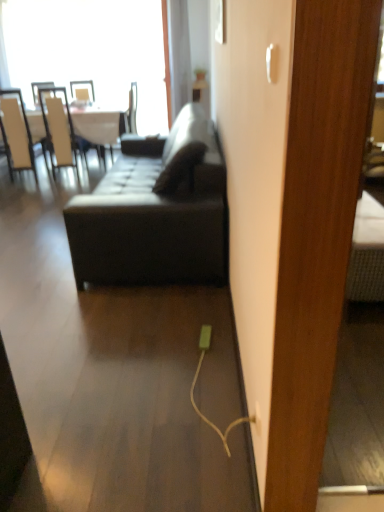
Question: Is white glossy table at upper left to the left of white leather chair at left, which ranks as the 2th chair in right-to-left order, from the viewer's perspective?

Choices:
 (A) yes
 (B) no

Answer: (B)

Question: Can you confirm if white glossy table at upper left is wider than white leather chair at left, which ranks as the 2th chair in right-to-left order?

Choices:
 (A) no
 (B) yes

Answer: (B)

Question: From a real-world perspective, is white glossy table at upper left on white leather chair at left, which ranks as the 2th chair in right-to-left order?

Choices:
 (A) no
 (B) yes

Answer: (A)

Question: From the image's perspective, is white glossy table at upper left under white leather chair at left, which appears as the 1th chair when viewed from the left?

Choices:
 (A) yes
 (B) no

Answer: (B)

Question: Is white leather chair at left, which ranks as the 2th chair in right-to-left order, located within white glossy table at upper left?

Choices:
 (A) yes
 (B) no

Answer: (A)

Question: Is white glossy table at upper left far from white leather chair at left, which appears as the 1th chair when viewed from the left?

Choices:
 (A) no
 (B) yes

Answer: (A)

Question: Would you consider white leather chair at left, the 2th chair in the left-to-right sequence, to be distant from matte black couch at center?

Choices:
 (A) no
 (B) yes

Answer: (B)

Question: Is white leather chair at left, the 2th chair in the left-to-right sequence, oriented towards matte black couch at center?

Choices:
 (A) yes
 (B) no

Answer: (B)

Question: Considering the relative positions of white leather chair at left, the 1th chair viewed from the right, and matte black couch at center in the image provided, is white leather chair at left, the 1th chair viewed from the right, to the right of matte black couch at center from the viewer's perspective?

Choices:
 (A) no
 (B) yes

Answer: (A)

Question: Considering the relative sizes of white leather chair at left, the 1th chair viewed from the right, and matte black couch at center in the image provided, is white leather chair at left, the 1th chair viewed from the right, taller than matte black couch at center?

Choices:
 (A) no
 (B) yes

Answer: (B)

Question: Is the depth of white leather chair at left, the 1th chair viewed from the right, greater than that of matte black couch at center?

Choices:
 (A) yes
 (B) no

Answer: (A)

Question: Can you confirm if white leather chair at left, the 1th chair viewed from the right, is bigger than matte black couch at center?

Choices:
 (A) yes
 (B) no

Answer: (B)

Question: Is matte black couch at center inside white glossy table at upper left?

Choices:
 (A) yes
 (B) no

Answer: (B)